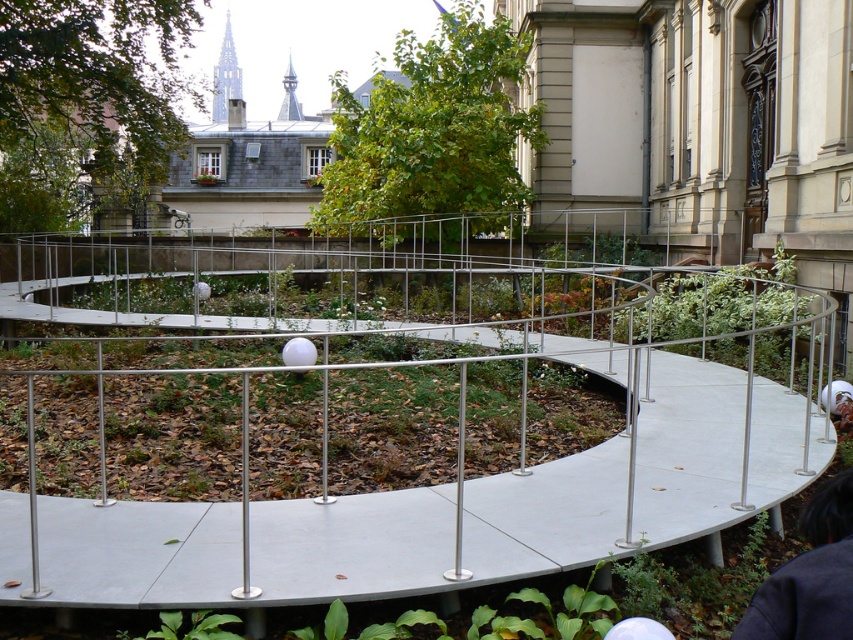
Is dark blue fabric at lower right to the left of white matte helmet at center from the viewer's perspective?

Correct, you'll find dark blue fabric at lower right to the left of white matte helmet at center.

How distant is dark blue fabric at lower right from white matte helmet at center?

dark blue fabric at lower right and white matte helmet at center are 4.87 meters apart.

Which is in front, point (767, 592) or point (834, 400)?

Point (767, 592) is more forward.

I want to click on dark blue fabric at lower right, so point(810,577).

Is metallic silver fence at center further to the viewer compared to white matte helmet at center?

No, metallic silver fence at center is closer to the viewer.

Which is above, metallic silver fence at center or white matte helmet at center?

metallic silver fence at center is higher up.

What do you see at coordinates (384, 408) in the screenshot? I see `metallic silver fence at center` at bounding box center [384, 408].

Locate an element on the screen. This screenshot has height=640, width=853. metallic silver fence at center is located at coordinates (384, 408).

Who is higher up, metallic silver fence at center or dark blue fabric at lower right?

metallic silver fence at center is higher up.

Who is more distant from viewer, (749, 412) or (744, 620)?

The point (749, 412) is more distant.

At what (x,y) coordinates should I click in order to perform the action: click on metallic silver fence at center. Please return your answer as a coordinate pair (x, y). Looking at the image, I should click on (384, 408).